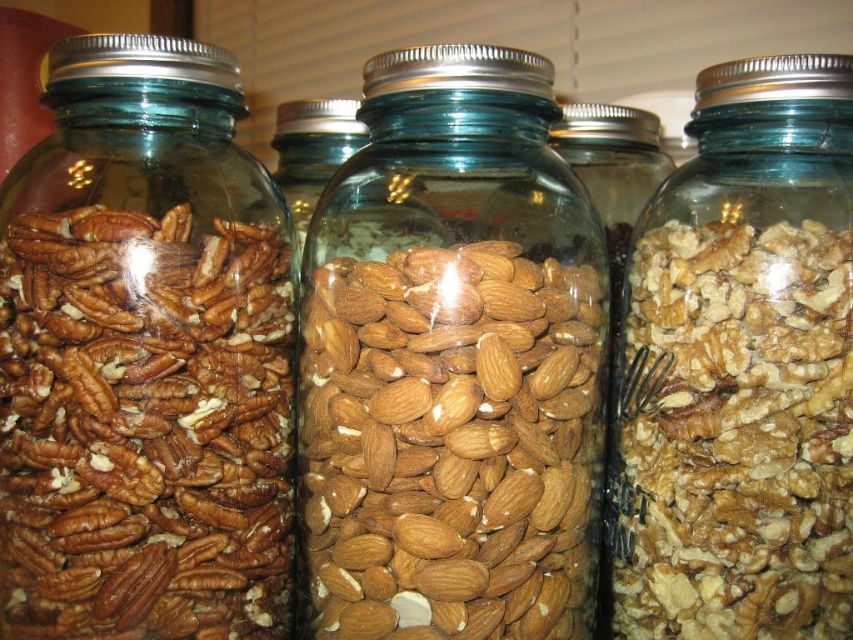
Question: Which point is closer to the camera?

Choices:
 (A) (485, 545)
 (B) (73, 115)

Answer: (A)

Question: Does brown matte pecans at left appear on the right side of translucent glass jar at center?

Choices:
 (A) yes
 (B) no

Answer: (B)

Question: Is the position of brown matte pecans at left less distant than that of brown textured nuts at center?

Choices:
 (A) no
 (B) yes

Answer: (B)

Question: Can you confirm if translucent glass jar at center is thinner than brown textured nuts at center?

Choices:
 (A) no
 (B) yes

Answer: (A)

Question: Which of these objects is positioned closest to the translucent glass jar at center?

Choices:
 (A) brown textured nuts at center
 (B) brown matte pecans at left

Answer: (B)

Question: Which object is positioned closest to the brown matte pecans at left?

Choices:
 (A) translucent glass jar at center
 (B) brown textured nuts at center

Answer: (A)